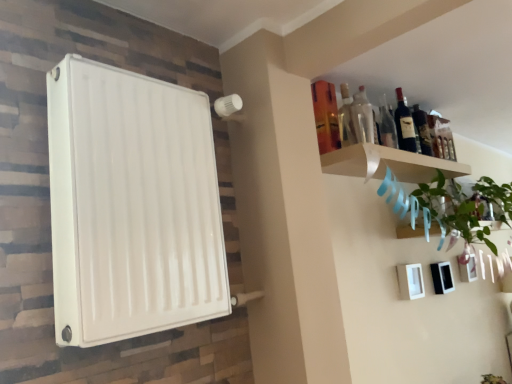
At what (x,y) coordinates should I click in order to perform the action: click on dark glass bottle at upper right, which is counted as the 4th bottle, starting from the left. Please return your answer as a coordinate pair (x, y). Looking at the image, I should click on (422, 130).

Image resolution: width=512 pixels, height=384 pixels. What do you see at coordinates (465, 206) in the screenshot? I see `green leafy plant at upper right` at bounding box center [465, 206].

Image resolution: width=512 pixels, height=384 pixels. What are the coordinates of `white wood shelf at upper right` in the screenshot? It's located at (388, 164).

Describe the element at coordinates (404, 125) in the screenshot. I see `dark glass bottle at upper right, the 2th bottle from the right` at that location.

Image resolution: width=512 pixels, height=384 pixels. Identify the location of dark glass bottle at upper right, which is the 2th bottle from front to back. (404, 125).

At what (x,y) coordinates should I click in order to perform the action: click on white matte radiator at left. Please return your answer as a coordinate pair (x, y). This screenshot has height=384, width=512. Looking at the image, I should click on (131, 205).

From a real-world perspective, which object rests below the other?

white matte picture frame at lower right, from a real-world perspective.

Is white matte picture frame at lower right not within dark glass bottle at upper right, which is the first bottle in back-to-front order?

white matte picture frame at lower right is positioned outside dark glass bottle at upper right, which is the first bottle in back-to-front order.

Image resolution: width=512 pixels, height=384 pixels. Identify the location of bottle on the right of white matte picture frame at lower right. (422, 130).

In terms of height, does white matte picture frame at lower right look taller or shorter compared to dark glass bottle at upper right, which appears as the 3th bottle when viewed from the back?

In the image, white matte picture frame at lower right appears to be shorter than dark glass bottle at upper right, which appears as the 3th bottle when viewed from the back.

What's the angular difference between white matte picture frame at lower right and dark glass bottle at upper right, which appears as the 3th bottle when viewed from the back,'s facing directions?

The angle between the facing direction of white matte picture frame at lower right and the facing direction of dark glass bottle at upper right, which appears as the 3th bottle when viewed from the back, is 0.00152 degrees.

Are white matte picture frame at lower right and dark glass bottle at upper right, the 2th bottle from the right, far apart?

white matte picture frame at lower right is actually quite close to dark glass bottle at upper right, the 2th bottle from the right.

I want to click on the 4th bottle above the white matte picture frame at lower right (from the image's perspective), so click(404, 125).

From the picture: Is dark glass bottle at upper right, which is the fourth bottle in front-to-back order, not within white wood shelf at upper right?

dark glass bottle at upper right, which is the fourth bottle in front-to-back order, is positioned outside white wood shelf at upper right.

The image size is (512, 384). I want to click on shelf on the left of dark glass bottle at upper right, which is counted as the 4th bottle, starting from the left, so click(388, 164).

How different are the orientations of dark glass bottle at upper right, which is counted as the 4th bottle, starting from the left, and white wood shelf at upper right in degrees?

0.00249 degrees separate the facing orientations of dark glass bottle at upper right, which is counted as the 4th bottle, starting from the left, and white wood shelf at upper right.

Is dark glass bottle at upper right, which is the 1th bottle in right-to-left order, in front of or behind white wood shelf at upper right in the image?

Visually, dark glass bottle at upper right, which is the 1th bottle in right-to-left order, is located behind white wood shelf at upper right.

From the image's perspective, is green leafy plant at upper right located above white matte picture frame at lower right?

Yes, from the image's perspective, green leafy plant at upper right is on top of white matte picture frame at lower right.

Does green leafy plant at upper right lie in front of white matte picture frame at lower right?

Yes, green leafy plant at upper right is in front of white matte picture frame at lower right.

Is green leafy plant at upper right facing towards white matte picture frame at lower right?

No, green leafy plant at upper right is not turned towards white matte picture frame at lower right.

Is green leafy plant at upper right not near white matte picture frame at lower right?

That's not correct — green leafy plant at upper right is a little close to white matte picture frame at lower right.

Is dark glass bottle at upper right, which is counted as the third bottle, starting from the left, at the right side of white matte picture frame at lower right?

In fact, dark glass bottle at upper right, which is counted as the third bottle, starting from the left, is to the left of white matte picture frame at lower right.

Which object is closer to the camera, dark glass bottle at upper right, which is the 2th bottle from front to back, or white matte picture frame at lower right?

dark glass bottle at upper right, which is the 2th bottle from front to back, is in front.

In the scene shown: Which is correct: dark glass bottle at upper right, the 2th bottle from the right, is inside white matte picture frame at lower right, or outside of it?

dark glass bottle at upper right, the 2th bottle from the right, is not enclosed by white matte picture frame at lower right.

Identify the location of the 4th bottle above when counting from the white matte picture frame at lower right (from the image's perspective). (404, 125).

Does transparent glass bottle at upper right, marked as the first bottle in a left-to-right arrangement, have a smaller size compared to dark glass bottle at upper right, which is the first bottle in back-to-front order?

Indeed, transparent glass bottle at upper right, marked as the first bottle in a left-to-right arrangement, has a smaller size compared to dark glass bottle at upper right, which is the first bottle in back-to-front order.

Between transparent glass bottle at upper right, marked as the 1th bottle in a front-to-back arrangement, and dark glass bottle at upper right, which is the first bottle in back-to-front order, which one appears on the right side from the viewer's perspective?

dark glass bottle at upper right, which is the first bottle in back-to-front order.

From the picture: Is there a large distance between transparent glass bottle at upper right, positioned as the 4th bottle in right-to-left order, and dark glass bottle at upper right, which is counted as the 4th bottle, starting from the left?

No.

From the image's perspective, would you say transparent glass bottle at upper right, positioned as the 4th bottle in right-to-left order, is shown under dark glass bottle at upper right, which is the fourth bottle in front-to-back order?

Yes, from the image's perspective, transparent glass bottle at upper right, positioned as the 4th bottle in right-to-left order, is below dark glass bottle at upper right, which is the fourth bottle in front-to-back order.

Could you tell me if white matte picture frame at lower right is turned towards green leafy plant at upper right?

No, white matte picture frame at lower right is not aimed at green leafy plant at upper right.

Considering the positions of objects white matte picture frame at lower right and green leafy plant at upper right in the image provided, who is more to the left, white matte picture frame at lower right or green leafy plant at upper right?

From the viewer's perspective, white matte picture frame at lower right appears more on the left side.

Based on the photo, is white matte picture frame at lower right bigger or smaller than green leafy plant at upper right?

Considering their sizes, white matte picture frame at lower right takes up less space than green leafy plant at upper right.

How much distance is there between white matte picture frame at lower right and green leafy plant at upper right?

The distance of white matte picture frame at lower right from green leafy plant at upper right is 16.99 inches.

Where is `bottle that appears behind the white matte picture frame at lower right`? This screenshot has width=512, height=384. bottle that appears behind the white matte picture frame at lower right is located at coordinates (422, 130).

Where is `picture frame on the right of dark glass bottle at upper right, which appears as the 3th bottle when viewed from the back`? This screenshot has width=512, height=384. picture frame on the right of dark glass bottle at upper right, which appears as the 3th bottle when viewed from the back is located at coordinates pos(410,281).

Based on their spatial positions, is white matte picture frame at lower right or transparent glass bottle at upper right, the 3th bottle positioned from the right, further from dark glass bottle at upper right, which is the fourth bottle in front-to-back order?

The object further to dark glass bottle at upper right, which is the fourth bottle in front-to-back order, is white matte picture frame at lower right.

Based on their spatial positions, is dark glass bottle at upper right, which is the fourth bottle in front-to-back order, or white matte radiator at left closer to white matte picture frame at lower right?

The object closer to white matte picture frame at lower right is dark glass bottle at upper right, which is the fourth bottle in front-to-back order.

Looking at the image, which one is located further to white wood shelf at upper right, transparent glass bottle at upper right, which is the fourth bottle in back-to-front order, or dark glass bottle at upper right, which appears as the 3th bottle when viewed from the back?

transparent glass bottle at upper right, which is the fourth bottle in back-to-front order, is further to white wood shelf at upper right.

When comparing their distances from transparent glass bottle at upper right, which is the fourth bottle in back-to-front order, does white matte radiator at left or dark glass bottle at upper right, which is the 1th bottle in right-to-left order, seem further?

Among the two, white matte radiator at left is located further to transparent glass bottle at upper right, which is the fourth bottle in back-to-front order.

Looking at the image, which one is located further to white wood shelf at upper right, transparent glass bottle at upper right, which is the fourth bottle in back-to-front order, or white matte radiator at left?

white matte radiator at left lies further to white wood shelf at upper right than the other object.

Considering their positions, is green leafy plant at upper right positioned closer to white matte radiator at left than dark glass bottle at upper right, which is the 1th bottle in right-to-left order?

dark glass bottle at upper right, which is the 1th bottle in right-to-left order.

Looking at the image, which one is located further to dark glass bottle at upper right, which is the 1th bottle in right-to-left order, white matte picture frame at lower right or white wood shelf at upper right?

white matte picture frame at lower right is further to dark glass bottle at upper right, which is the 1th bottle in right-to-left order.

Based on their spatial positions, is transparent glass bottle at upper right, marked as the first bottle in a left-to-right arrangement, or white matte radiator at left further from dark glass bottle at upper right, which is the first bottle in back-to-front order?

Based on the image, white matte radiator at left appears to be further to dark glass bottle at upper right, which is the first bottle in back-to-front order.

In order to click on houseplant between white wood shelf at upper right and dark glass bottle at upper right, which is the fourth bottle in front-to-back order, along the z-axis in this screenshot , I will do `click(465, 206)`.

Find the location of a particular element. This screenshot has height=384, width=512. houseplant between white matte radiator at left and transparent glass bottle at upper right, placed as the second bottle when sorted from back to front, along the z-axis is located at coordinates (465, 206).

At what (x,y) coordinates should I click in order to perform the action: click on houseplant between dark glass bottle at upper right, which appears as the 3th bottle when viewed from the back, and white matte picture frame at lower right vertically. Please return your answer as a coordinate pair (x, y). Looking at the image, I should click on (465, 206).

Locate an element on the screen. shelf between dark glass bottle at upper right, which is counted as the 4th bottle, starting from the left, and white matte picture frame at lower right vertically is located at coordinates pos(388,164).